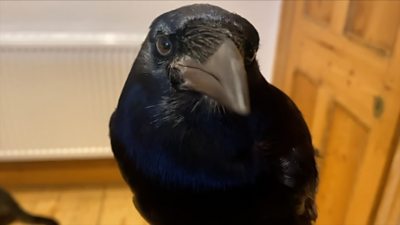
Identify the location of floor. This screenshot has width=400, height=225. (78, 214).